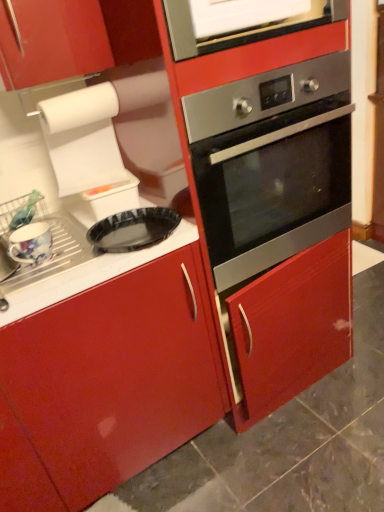
This screenshot has height=512, width=384. Identify the location of black glossy pizza pan at center. (133, 229).

Where is `black glossy pizza pan at center`? The image size is (384, 512). black glossy pizza pan at center is located at coordinates (133, 229).

Is stainless steel oven at center wider or thinner than black glossy pizza pan at center?

stainless steel oven at center is wider than black glossy pizza pan at center.

In the image, there is a stainless steel oven at center. What are the coordinates of `pizza pan below it (from a real-world perspective)` in the screenshot? It's located at (133, 229).

Is stainless steel oven at center bigger or smaller than black glossy pizza pan at center?

stainless steel oven at center is bigger than black glossy pizza pan at center.

Considering their positions, is stainless steel oven at center located in front of or behind black glossy pizza pan at center?

Clearly, stainless steel oven at center is in front of black glossy pizza pan at center.

From the image's perspective, is white glossy vent at upper center above or below black glossy pizza pan at center?

white glossy vent at upper center is situated higher than black glossy pizza pan at center in the image.

Considering the sizes of white glossy vent at upper center and black glossy pizza pan at center in the image, is white glossy vent at upper center taller or shorter than black glossy pizza pan at center?

Considering their sizes, white glossy vent at upper center has more height than black glossy pizza pan at center.

Does white glossy vent at upper center have a larger size compared to black glossy pizza pan at center?

Correct, white glossy vent at upper center is larger in size than black glossy pizza pan at center.

From a real-world perspective, between white glossy vent at upper center and black glossy pizza pan at center, who is vertically lower?

From a 3D spatial view, black glossy pizza pan at center is below.

Considering the relative positions of white glossy vent at upper center and stainless steel oven at center in the image provided, is white glossy vent at upper center to the right of stainless steel oven at center from the viewer's perspective?

In fact, white glossy vent at upper center is to the left of stainless steel oven at center.

Does white glossy vent at upper center have a larger size compared to stainless steel oven at center?

No.

Would you say stainless steel oven at center is part of white glossy vent at upper center's contents?

No, stainless steel oven at center is not a part of white glossy vent at upper center.

From a real-world perspective, between white glossy vent at upper center and floral ceramic mug at left, who is vertically lower?

In real-world perspective, floral ceramic mug at left is lower.

Choose the correct answer: Is white glossy vent at upper center inside floral ceramic mug at left or outside it?

The correct answer is: outside.

Between white glossy vent at upper center and floral ceramic mug at left, which one has less height?

Standing shorter between the two is floral ceramic mug at left.

Does black glossy pizza pan at center turn towards white glossy vent at upper center?

No, black glossy pizza pan at center is not turned towards white glossy vent at upper center.

How different are the orientations of black glossy pizza pan at center and white glossy vent at upper center in degrees?

The facing directions of black glossy pizza pan at center and white glossy vent at upper center are 3.54 degrees apart.

Considering the sizes of objects black glossy pizza pan at center and white glossy vent at upper center in the image provided, who is smaller, black glossy pizza pan at center or white glossy vent at upper center?

Smaller between the two is black glossy pizza pan at center.

Find the location of a particular element. This screenshot has width=384, height=512. vent above the black glossy pizza pan at center (from a real-world perspective) is located at coordinates (241, 29).

What's the angular difference between stainless steel oven at center and floral ceramic mug at left's facing directions?

The facing directions of stainless steel oven at center and floral ceramic mug at left are 3.37 degrees apart.

Are stainless steel oven at center and floral ceramic mug at left making contact?

No.

Which is correct: stainless steel oven at center is inside floral ceramic mug at left, or outside of it?

stainless steel oven at center is outside floral ceramic mug at left.

Locate an element on the screen. oven above the black glossy pizza pan at center (from the image's perspective) is located at coordinates (272, 164).

Consider the image. In terms of height, does black glossy pizza pan at center look taller or shorter compared to stainless steel oven at center?

black glossy pizza pan at center is shorter than stainless steel oven at center.

From the picture: Is black glossy pizza pan at center closer to camera compared to stainless steel oven at center?

That is False.

From the image's perspective, does black glossy pizza pan at center appear lower than stainless steel oven at center?

Yes, from the image's perspective, black glossy pizza pan at center is below stainless steel oven at center.

Where is `oven above the black glossy pizza pan at center (from the image's perspective)`? oven above the black glossy pizza pan at center (from the image's perspective) is located at coordinates point(272,164).

Where is `pizza pan below the white glossy vent at upper center (from the image's perspective)`? pizza pan below the white glossy vent at upper center (from the image's perspective) is located at coordinates (133, 229).

Estimate the real-world distances between objects in this image. Which object is further from black glossy pizza pan at center, white glossy vent at upper center or stainless steel oven at center?

white glossy vent at upper center is positioned further to the anchor black glossy pizza pan at center.

Looking at the image, which one is located closer to black glossy pizza pan at center, floral ceramic mug at left or white glossy vent at upper center?

The object closer to black glossy pizza pan at center is floral ceramic mug at left.

From the image, which object appears to be farther from white glossy vent at upper center, floral ceramic mug at left or stainless steel oven at center?

Based on the image, floral ceramic mug at left appears to be further to white glossy vent at upper center.

Looking at this image, based on their spatial positions, is stainless steel oven at center or floral ceramic mug at left closer to black glossy pizza pan at center?

Among the two, floral ceramic mug at left is located nearer to black glossy pizza pan at center.

Based on their spatial positions, is stainless steel oven at center or black glossy pizza pan at center closer to white glossy vent at upper center?

stainless steel oven at center is closer to white glossy vent at upper center.

Consider the image. Considering their positions, is black glossy pizza pan at center positioned further to stainless steel oven at center than white glossy vent at upper center?

Among the two, white glossy vent at upper center is located further to stainless steel oven at center.

Estimate the real-world distances between objects in this image. Which object is further from stainless steel oven at center, white glossy vent at upper center or black glossy pizza pan at center?

white glossy vent at upper center lies further to stainless steel oven at center than the other object.

Looking at the image, which one is located closer to stainless steel oven at center, floral ceramic mug at left or black glossy pizza pan at center?

black glossy pizza pan at center is positioned closer to the anchor stainless steel oven at center.

Locate an element on the screen. oven between white glossy vent at upper center and floral ceramic mug at left vertically is located at coordinates (272, 164).

Find the location of a particular element. The height and width of the screenshot is (512, 384). pizza pan between floral ceramic mug at left and stainless steel oven at center from left to right is located at coordinates (133, 229).

The width and height of the screenshot is (384, 512). I want to click on pizza pan between white glossy vent at upper center and floral ceramic mug at left in the up-down direction, so click(x=133, y=229).

The height and width of the screenshot is (512, 384). Identify the location of oven that lies between white glossy vent at upper center and black glossy pizza pan at center from top to bottom. (272, 164).